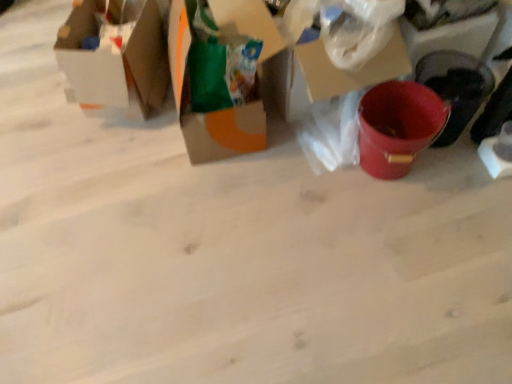
Question: Is matte cardboard box at upper left, which ranks as the second box in right-to-left order, at the left side of cardboard box at center, the 1th box when ordered from right to left?

Choices:
 (A) yes
 (B) no

Answer: (A)

Question: Can you confirm if matte cardboard box at upper left, the 1th box viewed from the left, is bigger than cardboard box at center, the 1th box when ordered from right to left?

Choices:
 (A) yes
 (B) no

Answer: (B)

Question: Considering the relative positions of matte cardboard box at upper left, the 1th box viewed from the left, and cardboard box at center, the 2th box viewed from the left, in the image provided, is matte cardboard box at upper left, the 1th box viewed from the left, to the right of cardboard box at center, the 2th box viewed from the left, from the viewer's perspective?

Choices:
 (A) no
 (B) yes

Answer: (A)

Question: Is matte cardboard box at upper left, the 1th box viewed from the left, smaller than cardboard box at center, the 1th box when ordered from right to left?

Choices:
 (A) yes
 (B) no

Answer: (A)

Question: Can you confirm if matte cardboard box at upper left, the 1th box viewed from the left, is taller than cardboard box at center, the 1th box when ordered from right to left?

Choices:
 (A) no
 (B) yes

Answer: (A)

Question: Is matte cardboard box at upper left, which ranks as the second box in right-to-left order, positioned with its back to cardboard box at center, the 1th box when ordered from right to left?

Choices:
 (A) no
 (B) yes

Answer: (B)

Question: Is cardboard box at center, the 2th box viewed from the left, positioned in front of matte cardboard box at upper left, which ranks as the second box in right-to-left order?

Choices:
 (A) yes
 (B) no

Answer: (A)

Question: Is cardboard box at center, the 1th box when ordered from right to left, far from matte cardboard box at upper left, the 1th box viewed from the left?

Choices:
 (A) no
 (B) yes

Answer: (A)

Question: From a real-world perspective, is cardboard box at center, the 1th box when ordered from right to left, positioned over matte cardboard box at upper left, which ranks as the second box in right-to-left order, based on gravity?

Choices:
 (A) yes
 (B) no

Answer: (A)

Question: From the image's perspective, is cardboard box at center, the 2th box viewed from the left, located beneath matte cardboard box at upper left, which ranks as the second box in right-to-left order?

Choices:
 (A) yes
 (B) no

Answer: (A)

Question: Considering the relative sizes of cardboard box at center, the 1th box when ordered from right to left, and matte cardboard box at upper left, which ranks as the second box in right-to-left order, in the image provided, is cardboard box at center, the 1th box when ordered from right to left, bigger than matte cardboard box at upper left, which ranks as the second box in right-to-left order,?

Choices:
 (A) yes
 (B) no

Answer: (A)

Question: Considering the relative sizes of cardboard box at center, the 2th box viewed from the left, and matte cardboard box at upper left, the 1th box viewed from the left, in the image provided, is cardboard box at center, the 2th box viewed from the left, thinner than matte cardboard box at upper left, the 1th box viewed from the left,?

Choices:
 (A) yes
 (B) no

Answer: (B)

Question: Is point (228, 104) closer or farther from the camera than point (128, 72)?

Choices:
 (A) closer
 (B) farther

Answer: (A)